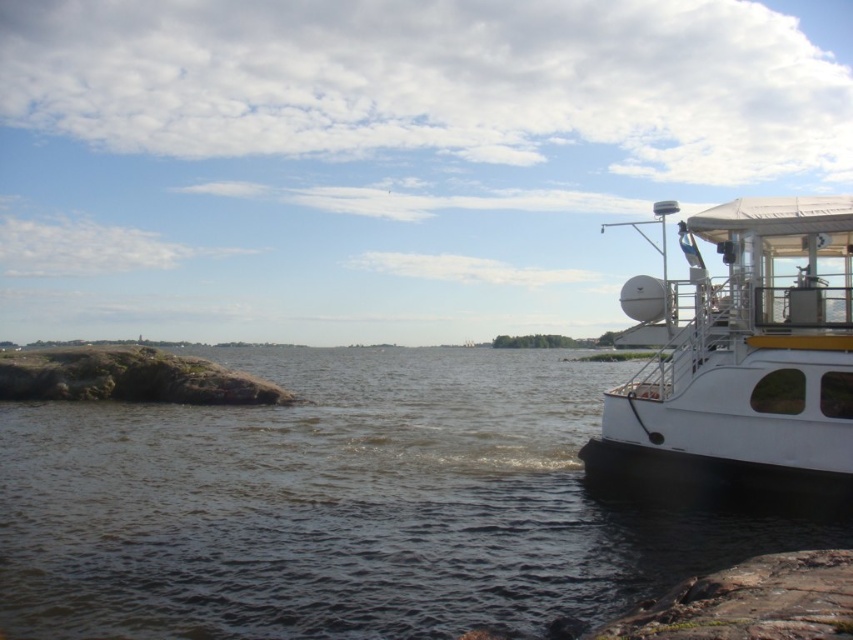
Question: Is brown water at lower left bigger than white glossy boat at right?

Choices:
 (A) yes
 (B) no

Answer: (A)

Question: Where is brown water at lower left located in relation to white glossy boat at right in the image?

Choices:
 (A) below
 (B) above

Answer: (A)

Question: From the image, what is the correct spatial relationship of brown water at lower left in relation to white glossy boat at right?

Choices:
 (A) right
 (B) left

Answer: (B)

Question: Which of the following is the closest to the observer?

Choices:
 (A) white glossy boat at right
 (B) brown water at lower left

Answer: (B)